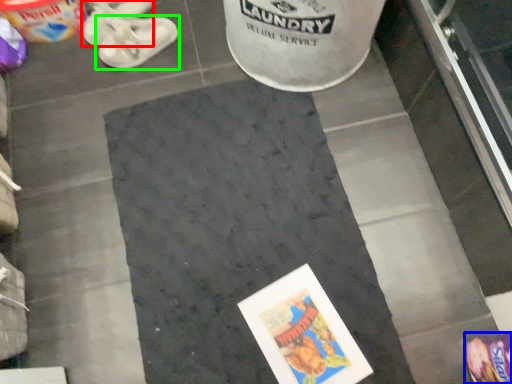
Question: Considering the real-world distances, which object is closest to footwear (highlighted by a red box)? footwear (highlighted by a blue box) or footwear (highlighted by a green box).

Choices:
 (A) footwear
 (B) footwear

Answer: (B)